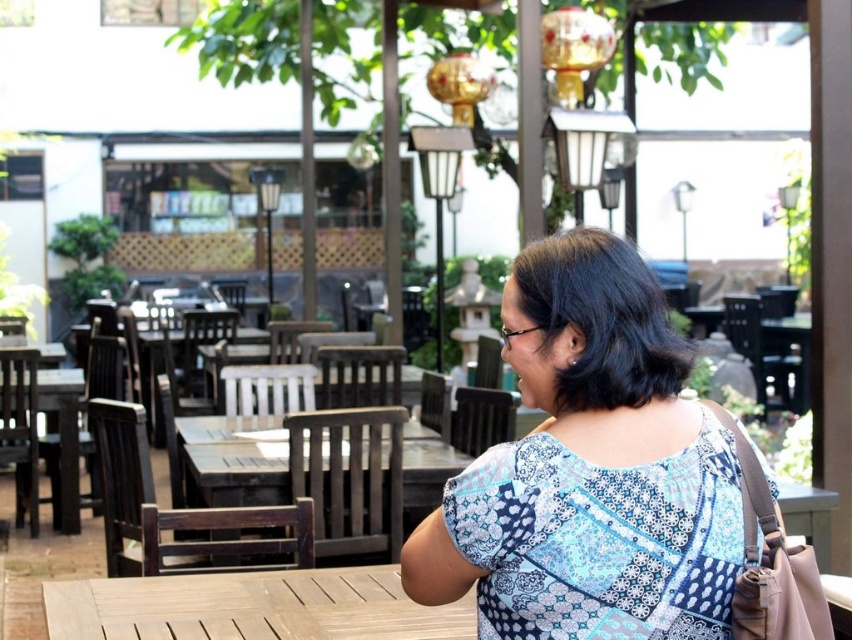
Based on the photo, does blue printed blouse at center appear over light brown wooden table at center?

Yes, blue printed blouse at center is above light brown wooden table at center.

Does blue printed blouse at center have a larger size compared to light brown wooden table at center?

Indeed, blue printed blouse at center has a larger size compared to light brown wooden table at center.

Measure the distance between point (510, 292) and camera.

They are 2.23 meters apart.

Locate an element on the screen. blue printed blouse at center is located at coordinates click(x=590, y=468).

Does blue printed blouse at center have a greater width compared to wooden table at center?

In fact, blue printed blouse at center might be narrower than wooden table at center.

How distant is blue printed blouse at center from wooden table at center?

They are 2.92 meters apart.

The height and width of the screenshot is (640, 852). I want to click on blue printed blouse at center, so click(590, 468).

Find the location of a particular element. blue printed blouse at center is located at coordinates (590, 468).

Looking at this image, is light brown wooden table at center to the right of wooden table at center from the viewer's perspective?

Correct, you'll find light brown wooden table at center to the right of wooden table at center.

Does point (202, 627) lie behind point (407, 477)?

That is False.

I want to click on light brown wooden table at center, so click(250, 608).